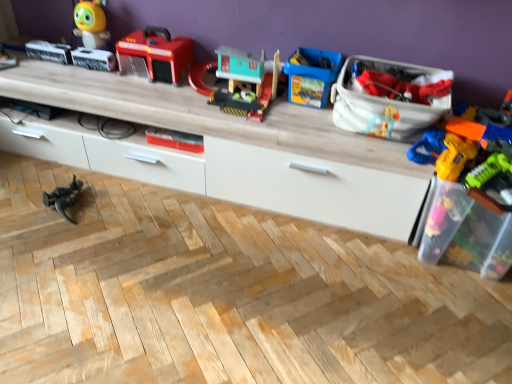
Question: In the image, is matte plastic toy at center, which is counted as the fourth toy, starting from the left, positioned in front of or behind white fabric bag at upper right, which appears as the second storage box when viewed from the right?

Choices:
 (A) behind
 (B) front

Answer: (A)

Question: From the image's perspective, relative to white fabric bag at upper right, which is counted as the first storage box, starting from the left, is matte plastic toy at center, which is counted as the fourth toy, starting from the left, above or below?

Choices:
 (A) below
 (B) above

Answer: (A)

Question: Which object is positioned closest to the translucent plastic toy gun at right, which ranks as the 7th toy in left-to-right order?

Choices:
 (A) transparent plastic toy box at right, the 2th storage box from the left
 (B) matte plastic toy house at center, which is the 3th toy in right-to-left order
 (C) matte plastic toy at center, which is counted as the fourth toy, starting from the left
 (D) shiny plastic toy at upper left, the second toy in the left-to-right sequence
 (E) black plastic dinosaur at lower left, the 7th toy from the right

Answer: (A)

Question: Which is nearer to the transparent plastic toy box at right, the 2th storage box from the left?

Choices:
 (A) blue plastic toy at center, marked as the 6th toy in a left-to-right arrangement
 (B) shiny plastic toy at upper left, the second toy in the left-to-right sequence
 (C) matte plastic toy house at center, which is the 3th toy in right-to-left order
 (D) matte plastic toy at center, which is the 4th toy from right to left
 (E) matte plastic fire truck at upper center, which is the 5th toy from right to left

Answer: (A)